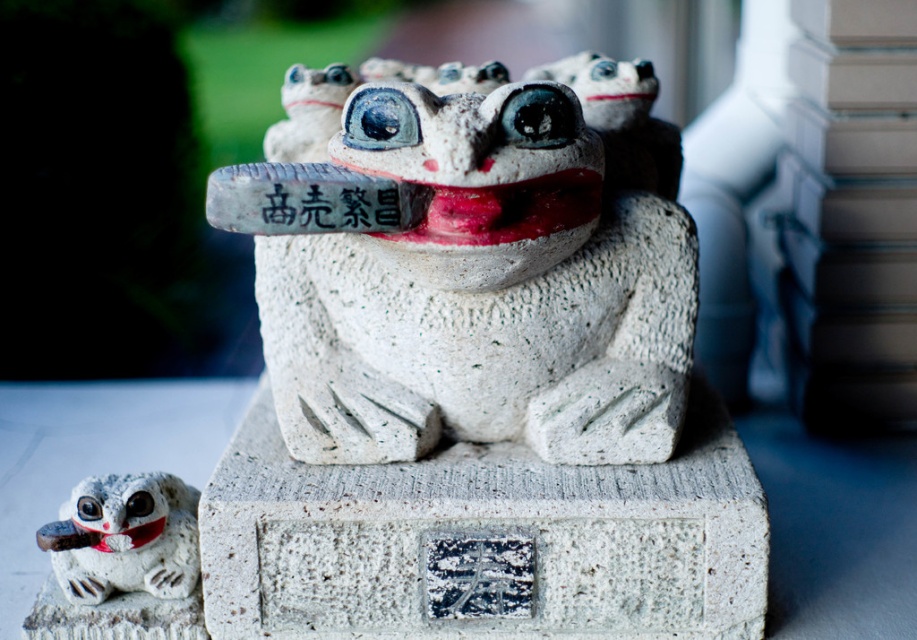
Which is behind, point (466, 250) or point (155, 548)?

The point (155, 548) is more distant.

Who is more forward, (507, 435) or (50, 531)?

Positioned in front is point (50, 531).

Identify the location of white stone frog at center. This screenshot has width=917, height=640. (484, 285).